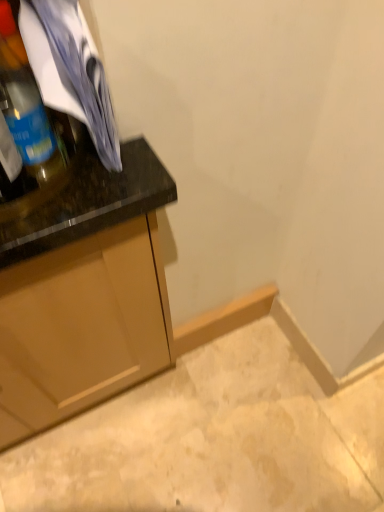
The image size is (384, 512). I want to click on translucent plastic bottle at left, so click(26, 105).

Measure the distance between point (15, 104) and camera.

Point (15, 104) and camera are 22.24 inches apart.

What do you see at coordinates (26, 105) in the screenshot? Image resolution: width=384 pixels, height=512 pixels. I see `translucent plastic bottle at left` at bounding box center [26, 105].

This screenshot has width=384, height=512. Find the location of `translucent plastic bottle at left`. translucent plastic bottle at left is located at coordinates (26, 105).